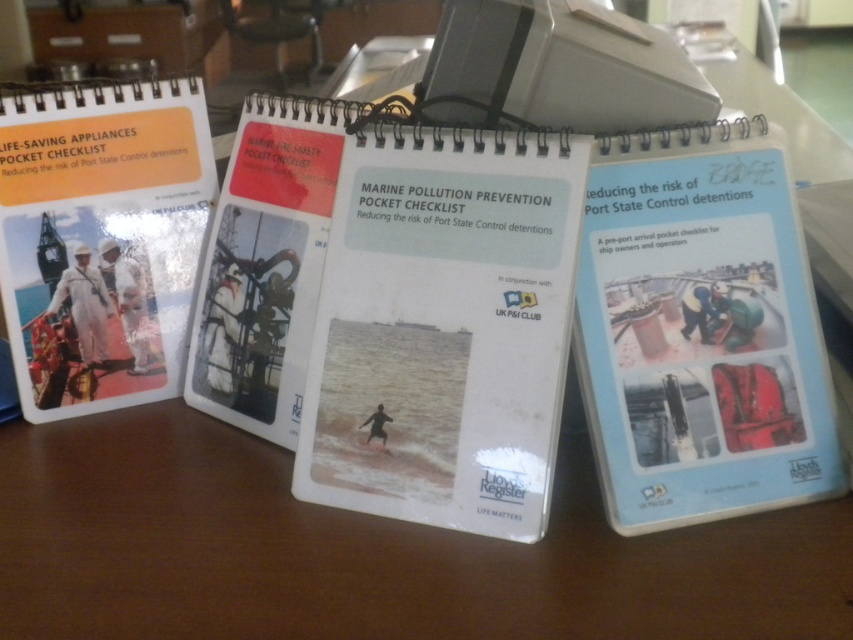
Question: From the image, what is the correct spatial relationship of white paper notebook at center in relation to white plastic notebook at right?

Choices:
 (A) above
 (B) below

Answer: (B)

Question: Which object is the closest to the white paper notebook at center?

Choices:
 (A) white plastic notebook at right
 (B) matte white book at left

Answer: (A)

Question: Which of the following is the closest to the observer?

Choices:
 (A) white plastic notebook at right
 (B) white paper notebook at center

Answer: (A)

Question: Can you confirm if white plastic notebook at right is positioned above matte white book at left?

Choices:
 (A) yes
 (B) no

Answer: (B)

Question: Which of the following is the closest to the observer?

Choices:
 (A) (339, 232)
 (B) (25, 298)

Answer: (A)

Question: Does white paper notebook at center appear under white plastic notebook at right?

Choices:
 (A) yes
 (B) no

Answer: (A)